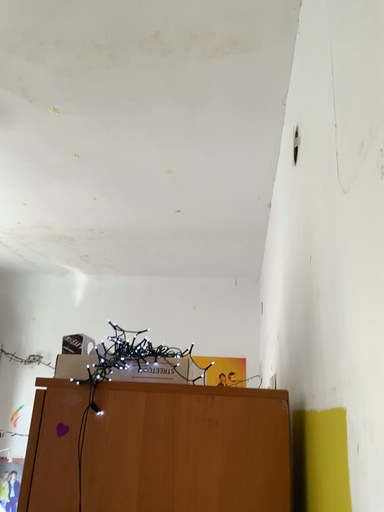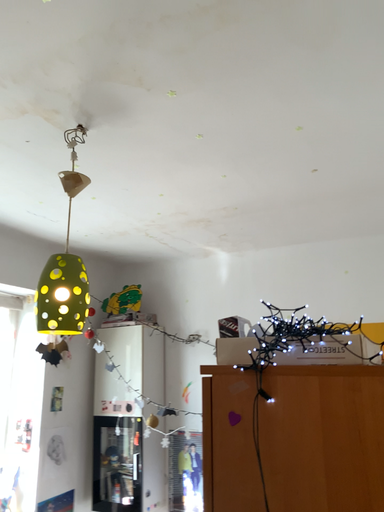
Question: How did the camera likely rotate when shooting the video?

Choices:
 (A) rotated right
 (B) rotated left

Answer: (B)